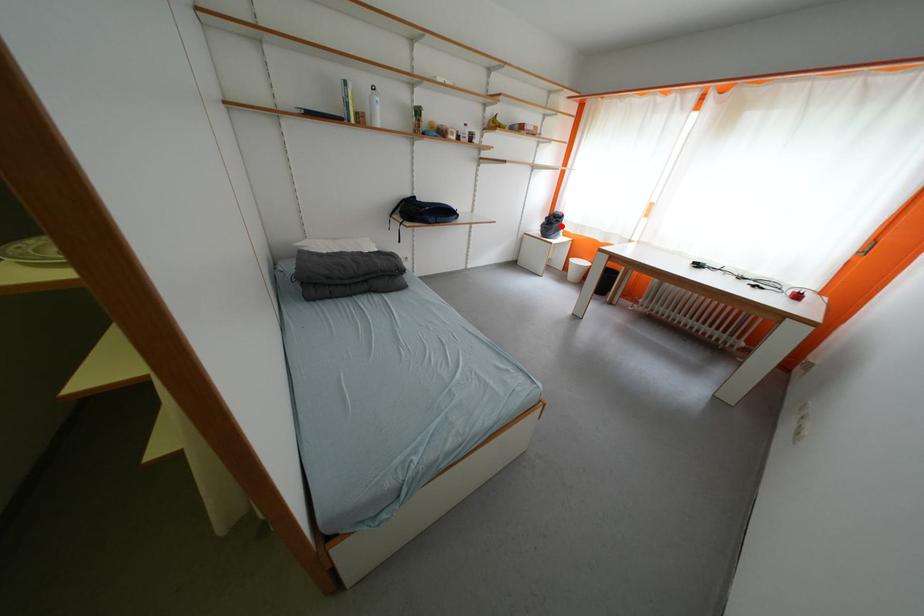
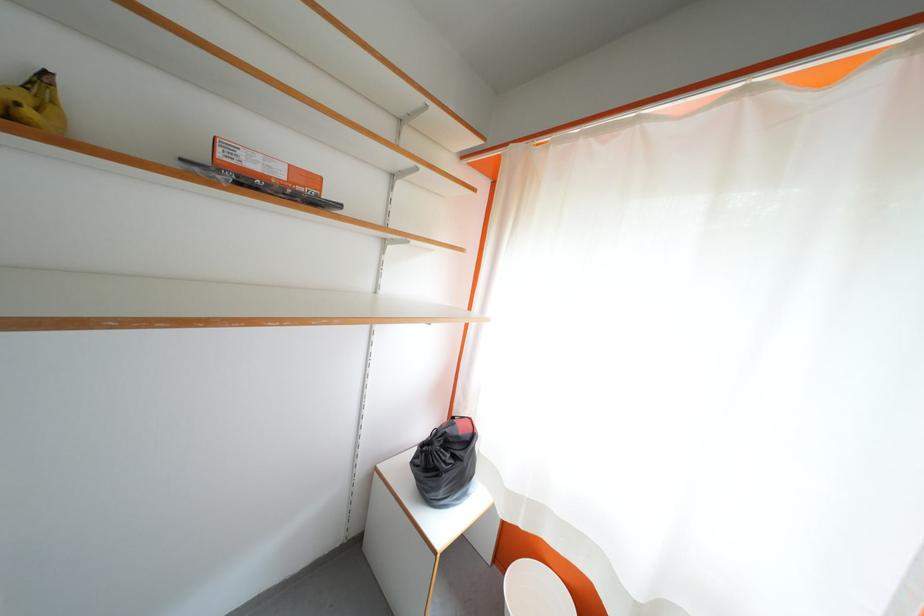
Find the pixel in the second image that matches the highlighted location in the first image.

(455, 460)